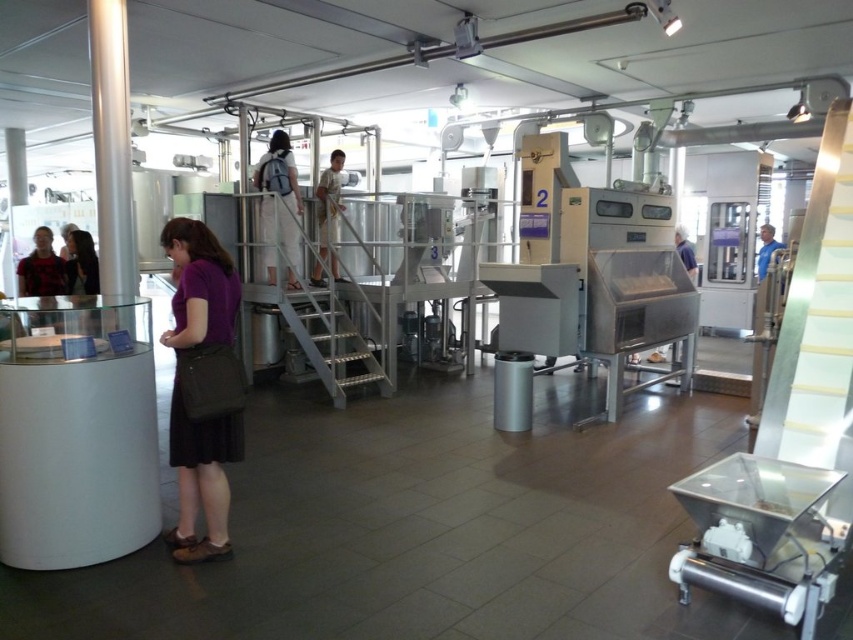
You are a delivery person carrying a light beige fabric backpack at center and need to hand over a package to the person wearing a matte black shirt at left. Which direction should you move to reach them?

The light beige fabric backpack at center is to the right of the matte black shirt at left, so you should move to the left to reach the person wearing the matte black shirt at left.